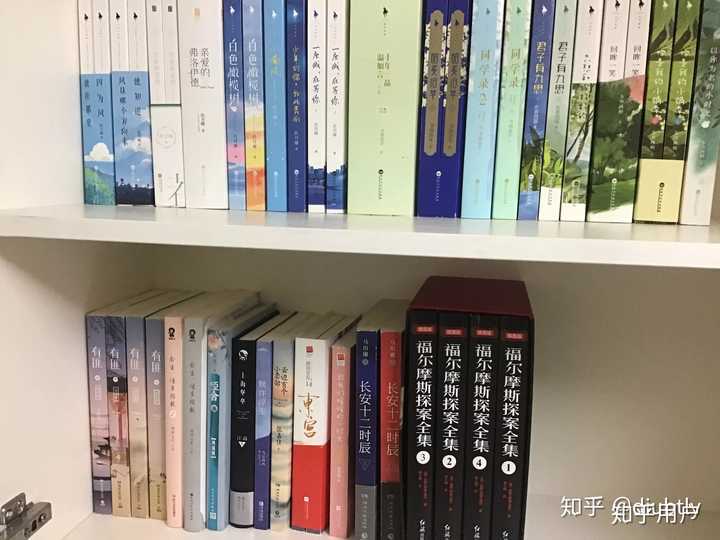
The height and width of the screenshot is (540, 720). I want to click on green books, so click(x=392, y=108), click(x=508, y=105), click(x=554, y=105), click(x=616, y=109), click(x=577, y=106), click(x=657, y=94), click(x=672, y=87), click(x=706, y=87).